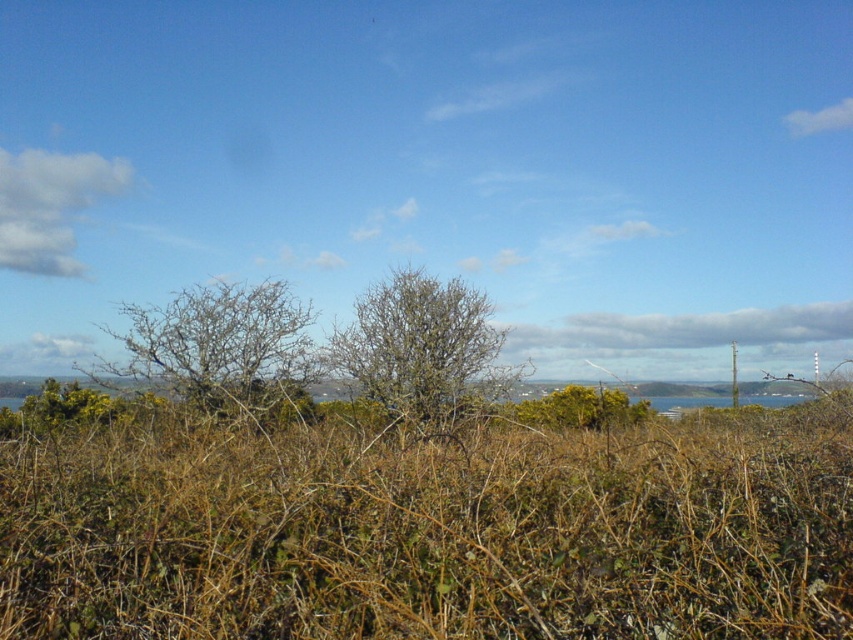
You are a gardener planning to transplant the green leafy bush at lower left and the green leafy bush at center to a new garden. If you want to prioritize moving the larger bush first, which one should you move first?

The green leafy bush at center is larger than the green leafy bush at lower left, so you should move the green leafy bush at center first.

You are standing in the natural landscape described. There is a point at coordinates point (424,349). What is located at that point?

The point at coordinates point (424,349) corresponds to bare branches at center.

You are standing in the natural landscape described, looking towards the body of water in the background. Which direction should you walk to get closer to the bare branches at left?

The bare branches at left are located at point (223,349), so you should walk to the left to get closer to them.